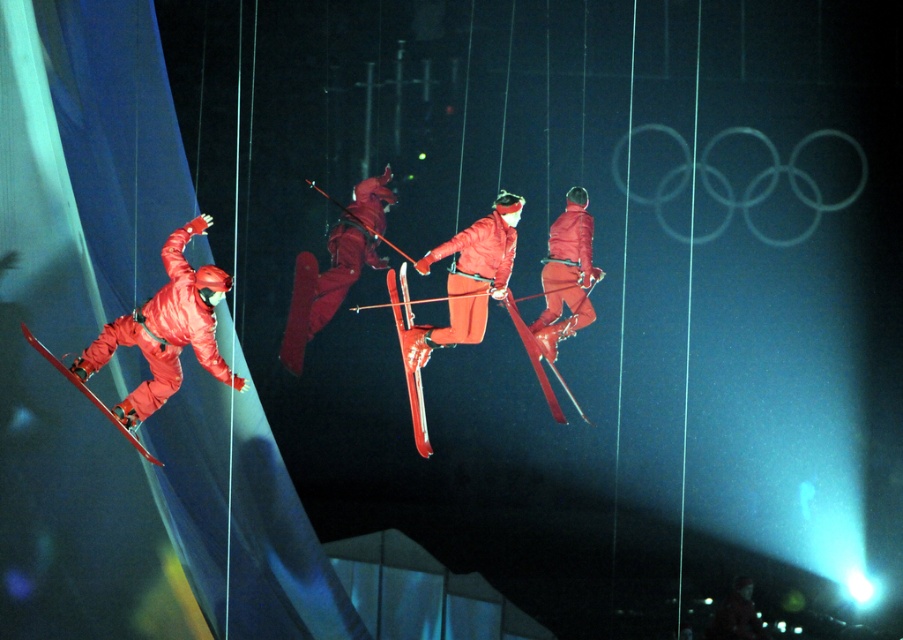
Question: Is matte orange ski suit at center above metallic red skis at center?

Choices:
 (A) no
 (B) yes

Answer: (B)

Question: Which of the following is the farthest from the observer?

Choices:
 (A) matte red ski suit at center
 (B) shiny red skis at center

Answer: (A)

Question: Among these points, which one is farthest from the camera?

Choices:
 (A) (294, 339)
 (B) (396, 282)

Answer: (A)

Question: Which of the following is the closest to the observer?

Choices:
 (A) shiny red skis at center
 (B) matte red ski suit at center

Answer: (A)

Question: Is matte red ski suit at left wider than shiny red skis at center?

Choices:
 (A) no
 (B) yes

Answer: (B)

Question: Does matte red ski suit at left appear under matte orange ski suit at center?

Choices:
 (A) no
 (B) yes

Answer: (B)